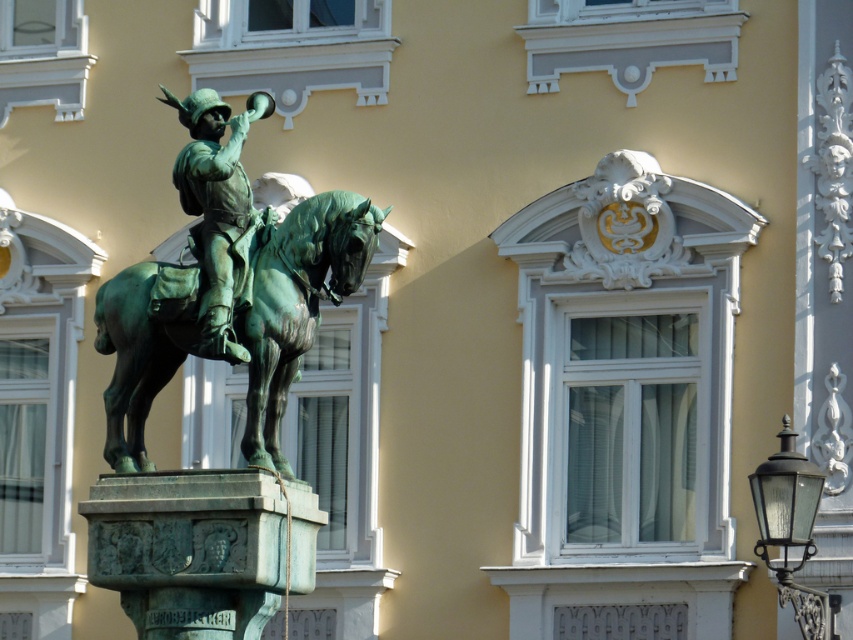
Does green patina horse at center appear on the right side of bronze statue at center?

Correct, you'll find green patina horse at center to the right of bronze statue at center.

Can you confirm if green patina horse at center is positioned above bronze statue at center?

No, green patina horse at center is not above bronze statue at center.

The height and width of the screenshot is (640, 853). What are the coordinates of `green patina horse at center` in the screenshot? It's located at (297, 304).

The image size is (853, 640). Identify the location of green patina horse at center. (297, 304).